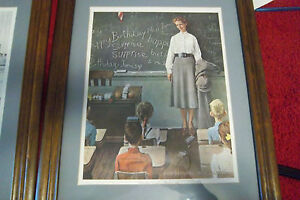
Where is `frame mat`? frame mat is located at coordinates (19, 39), (82, 52).